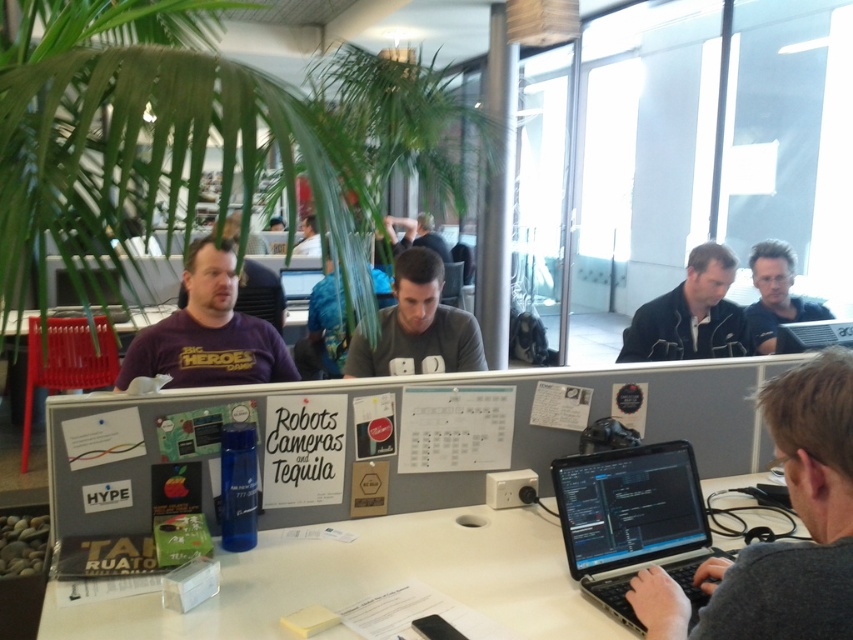
Question: Which object is farther from the camera taking this photo?

Choices:
 (A) matte black shirt at center
 (B) dark blue shirt at upper right
 (C) black plastic computer at right

Answer: (A)

Question: Does dark blue jacket at upper right appear on the right side of matte black shirt at center?

Choices:
 (A) yes
 (B) no

Answer: (A)

Question: Which is farther from the white plastic table at center?

Choices:
 (A) gray fabric shirt at lower right
 (B) matte black shirt at center
 (C) silver metallic laptop at center

Answer: (B)

Question: Which point is closer to the camera?

Choices:
 (A) (692, 324)
 (B) (776, 378)
 (C) (273, 362)
 (D) (418, 339)

Answer: (B)

Question: Is purple t-shirt at center smaller than black plastic computer at right?

Choices:
 (A) yes
 (B) no

Answer: (B)

Question: Can you confirm if silver metallic laptop at center is positioned below purple t-shirt at center?

Choices:
 (A) no
 (B) yes

Answer: (B)